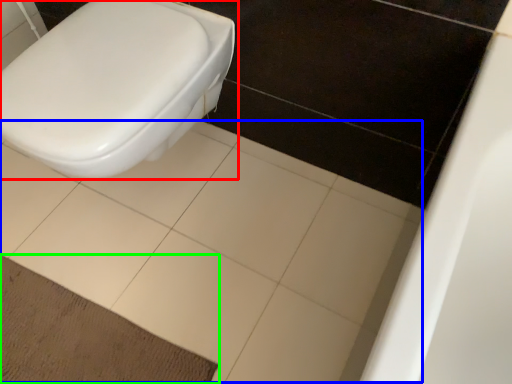
Question: Based on their relative distances, which object is nearer to toilet (highlighted by a red box)? Choose from ceramic tile (highlighted by a blue box) and doormat (highlighted by a green box).

Choices:
 (A) ceramic tile
 (B) doormat

Answer: (A)